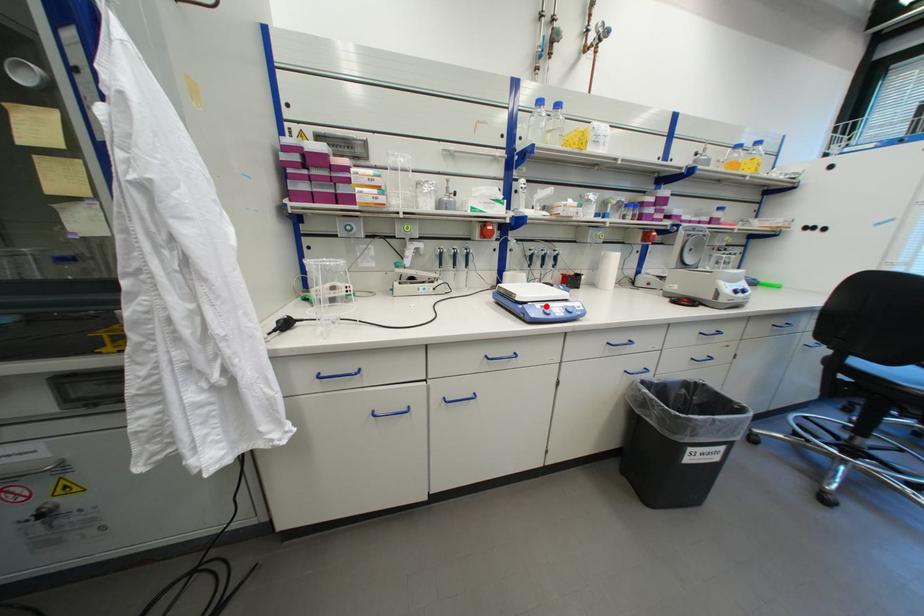
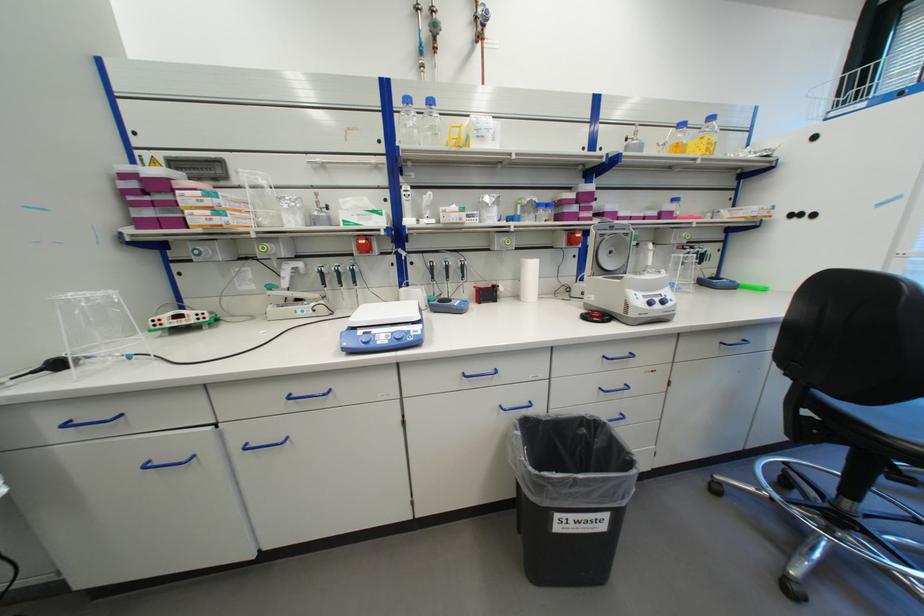
In the second image, find the point that corresponds to the highlighted location in the first image.

(369, 333)